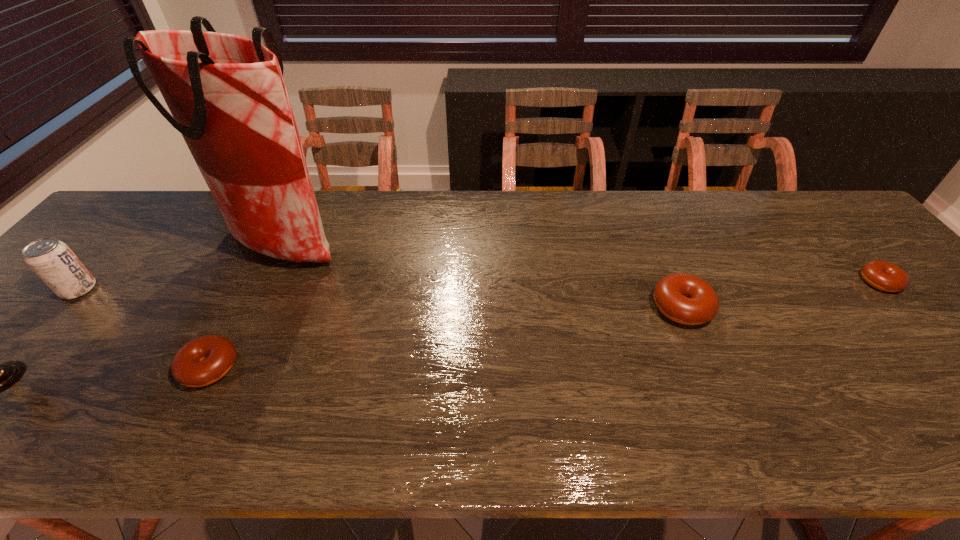
I want to click on spot to insert another doughnut for uniform distribution, so [x=460, y=335].